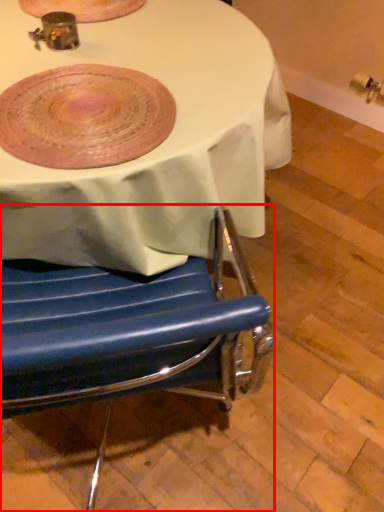
Question: From the image's perspective, considering the relative positions of chair (annotated by the red box) and platter in the image provided, where is chair (annotated by the red box) located with respect to the staircase?

Choices:
 (A) above
 (B) below

Answer: (B)